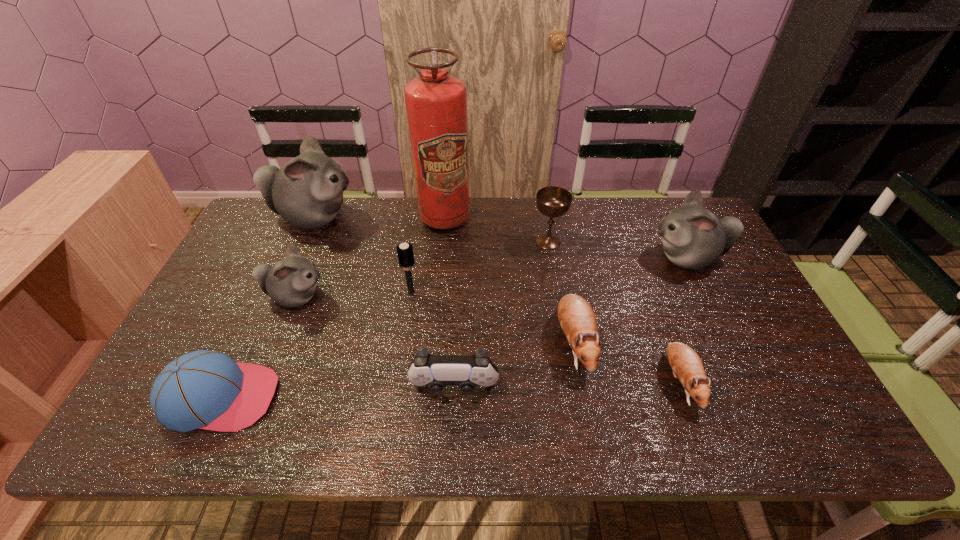
Find the location of a particular element. This screenshot has width=960, height=540. free space at the far left corner is located at coordinates (253, 226).

This screenshot has height=540, width=960. Identify the location of vacant space at the near left corner. (127, 443).

Find the location of `free area in between the rightmost white hamster and the red fire extinguisher`. free area in between the rightmost white hamster and the red fire extinguisher is located at coordinates (566, 238).

This screenshot has width=960, height=540. I want to click on vacant point located between the chalice and the fourth shortest hamster, so click(617, 249).

The image size is (960, 540). Find the location of `empty space that is in between the hairbrush and the chalice`. empty space that is in between the hairbrush and the chalice is located at coordinates (x=480, y=267).

Image resolution: width=960 pixels, height=540 pixels. Find the location of `vacant region between the shortest hamster and the bigger brown hamster`. vacant region between the shortest hamster and the bigger brown hamster is located at coordinates (627, 362).

Where is `free spot between the tallest object and the hairbrush`? This screenshot has height=540, width=960. free spot between the tallest object and the hairbrush is located at coordinates (428, 255).

Locate an element on the screen. The height and width of the screenshot is (540, 960). free area in between the third tallest object and the tallest hamster is located at coordinates (500, 238).

Identify the location of free space that is in between the shortest object and the hairbrush. (546, 336).

Locate an element on the screen. The image size is (960, 540). free spot between the second shortest hamster and the second farthest white hamster is located at coordinates (631, 300).